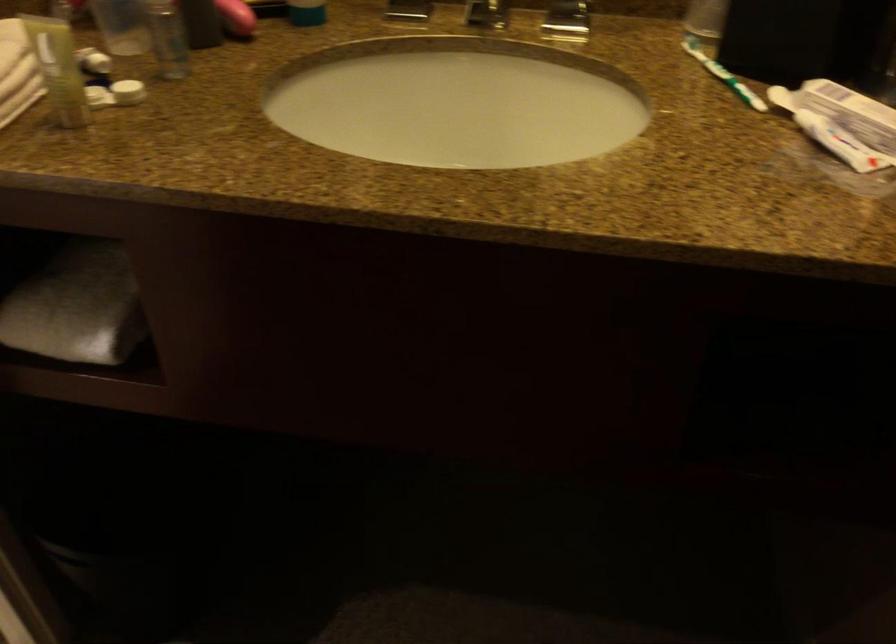
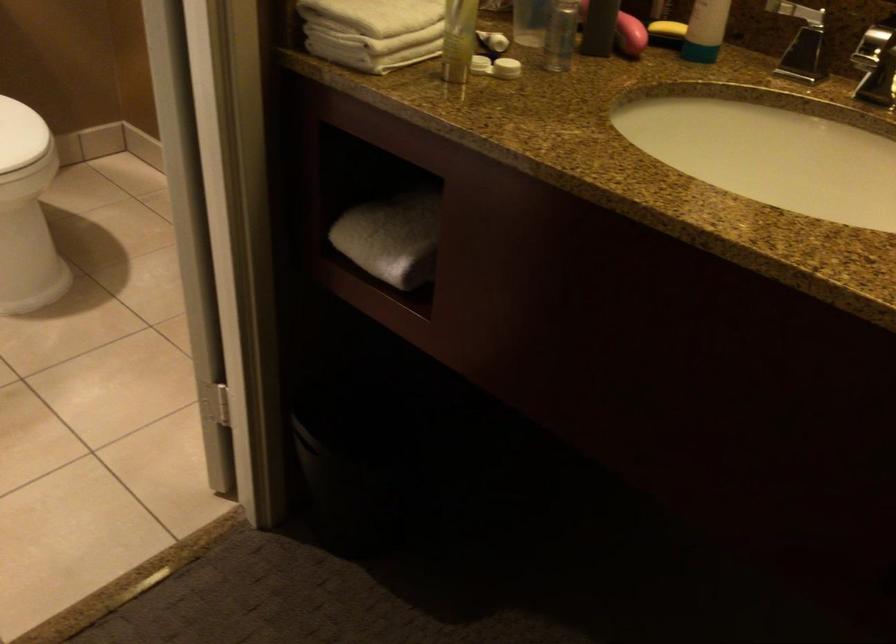
Question: The images are taken continuously from a first-person perspective. In which direction is your viewpoint rotating?

Choices:
 (A) Left
 (B) Right
 (C) Up
 (D) Down

Answer: (A)